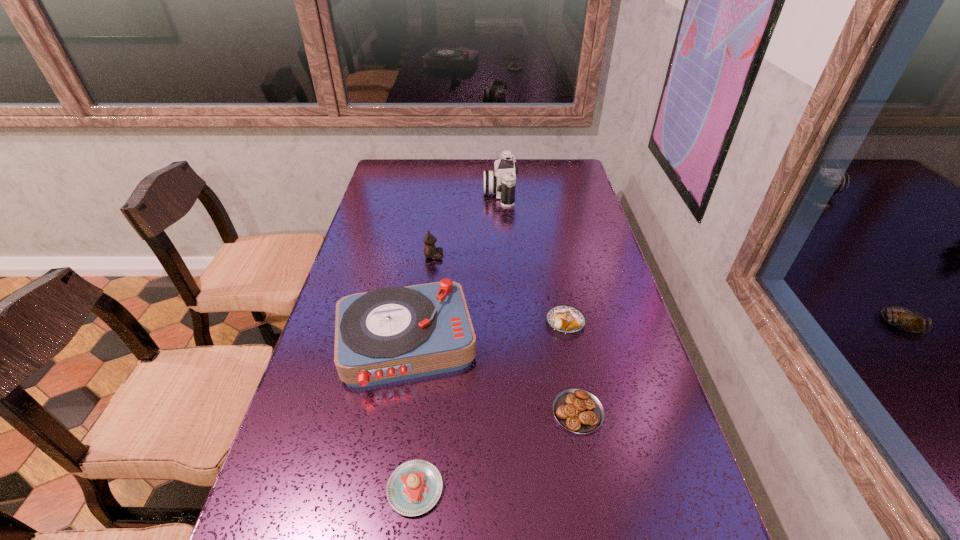
The image size is (960, 540). Find the location of `vacant space at the far left corner of the desktop`. vacant space at the far left corner of the desktop is located at coordinates [x=413, y=161].

Find the location of a particular element. vacant space that is in between the second nearest pastry and the nearest object is located at coordinates (496, 450).

In order to click on free space between the leftmost pastry and the second nearest pastry in this screenshot , I will do `click(496, 450)`.

At what (x,y) coordinates should I click in order to perform the action: click on empty space between the second nearest pastry and the second farthest object. Please return your answer as a coordinate pair (x, y). Looking at the image, I should click on (506, 334).

Identify the location of free space that is in between the teddy bear and the farthest pastry. The width and height of the screenshot is (960, 540). (499, 289).

At what (x,y) coordinates should I click in order to perform the action: click on unoccupied area between the second nearest pastry and the record player. Please return your answer as a coordinate pair (x, y). Looking at the image, I should click on (492, 378).

I want to click on free space between the farthest pastry and the second nearest pastry, so pyautogui.click(x=571, y=367).

Where is `free space between the third object from right to left and the fourth shortest object`? free space between the third object from right to left and the fourth shortest object is located at coordinates (467, 224).

At what (x,y) coordinates should I click in order to perform the action: click on unoccupied position between the farthest object and the second tallest object. Please return your answer as a coordinate pair (x, y). The image size is (960, 540). Looking at the image, I should click on (453, 267).

The height and width of the screenshot is (540, 960). I want to click on free space that is in between the second nearest pastry and the nearest pastry, so click(x=496, y=450).